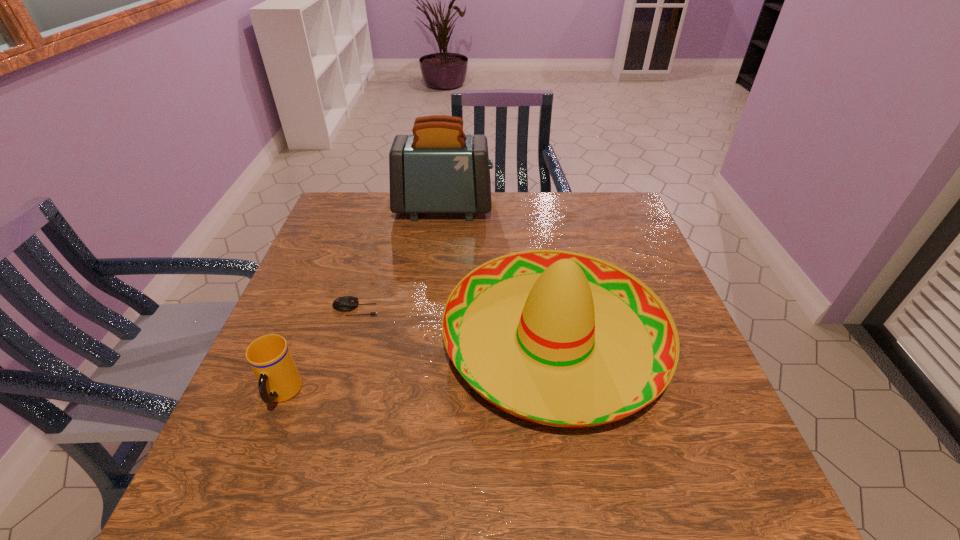
Locate an element on the screen. This screenshot has height=540, width=960. toaster is located at coordinates (438, 169).

Locate an element on the screen. The width and height of the screenshot is (960, 540). the farthest object is located at coordinates (438, 169).

Locate an element on the screen. This screenshot has width=960, height=540. sombrero is located at coordinates (559, 338).

The height and width of the screenshot is (540, 960). What are the coordinates of `the third tallest object` in the screenshot? It's located at (269, 356).

Locate an element on the screen. Image resolution: width=960 pixels, height=540 pixels. the leftmost object is located at coordinates (269, 356).

The width and height of the screenshot is (960, 540). What are the coordinates of `the shortest object` in the screenshot? It's located at (345, 303).

In order to click on free space located 0.180m on the front-facing side of the farthest object in this screenshot , I will do `click(548, 208)`.

Where is `free space located 0.320m on the back of the second tallest object`? This screenshot has width=960, height=540. free space located 0.320m on the back of the second tallest object is located at coordinates (532, 205).

Where is `free space located 0.080m on the side of the cup with the handle`? free space located 0.080m on the side of the cup with the handle is located at coordinates (257, 458).

The image size is (960, 540). In order to click on blank space located 0.330m on the right of the shortest object in this screenshot , I will do `click(516, 308)`.